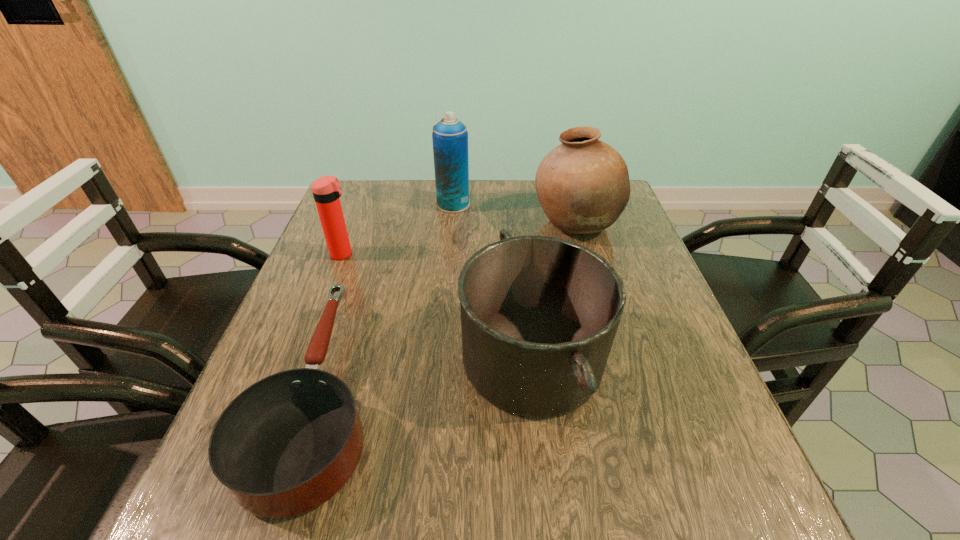
You are a GUI agent. You are given a task and a screenshot of the screen. Output one action in this format:
    pyautogui.click(x=<x>, y=<y>)
    Task: Click on the vacant space situated 0.060m on the handle side of the shortest object
    The height and width of the screenshot is (540, 960).
    Given the screenshot: What is the action you would take?
    click(x=351, y=292)

Find the location of a particular element. The height and width of the screenshot is (540, 960). free space located on the handle side of the shortest object is located at coordinates (369, 240).

The width and height of the screenshot is (960, 540). I want to click on aerosol can that is at the far edge, so click(450, 136).

You are a GUI agent. You are given a task and a screenshot of the screen. Output one action in this format:
    pyautogui.click(x=<x>, y=<y>)
    Task: Click on the pottery located in the far edge section of the desktop
    This screenshot has width=960, height=540.
    Given the screenshot: What is the action you would take?
    pyautogui.click(x=583, y=186)

I want to click on object that is at the near edge, so click(x=288, y=443).

What are the coordinates of `thermos bottle at the left edge` in the screenshot? It's located at (326, 190).

The width and height of the screenshot is (960, 540). What are the coordinates of `pan located in the left edge section of the desktop` in the screenshot? It's located at click(x=288, y=443).

The width and height of the screenshot is (960, 540). Identify the location of object present at the right edge. (583, 186).

Find the location of a particular element. object at the near left corner is located at coordinates (288, 443).

The height and width of the screenshot is (540, 960). In order to click on object that is at the far right corner in this screenshot , I will do `click(583, 186)`.